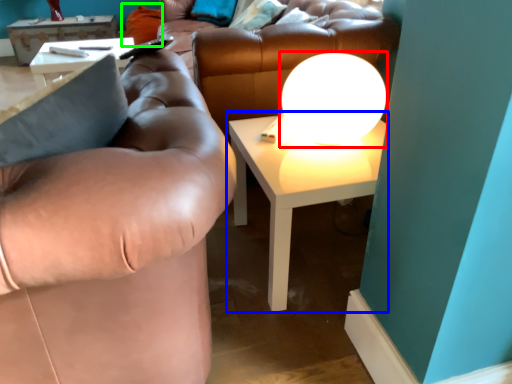
Question: Which object is the farthest from table lamp (highlighted by a red box)? Choose among these: table (highlighted by a blue box) or pillow (highlighted by a green box).

Choices:
 (A) table
 (B) pillow

Answer: (B)